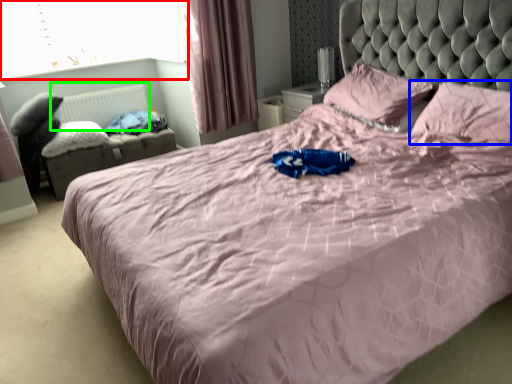
Question: Which object is the closest to the window screen (highlighted by a red box)? Choose among these: pillow (highlighted by a blue box) or radiator (highlighted by a green box).

Choices:
 (A) pillow
 (B) radiator

Answer: (B)